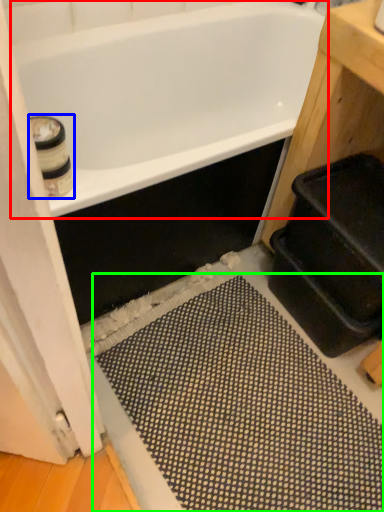
Question: Estimate the real-world distances between objects in this image. Which object is closer to bathtub (highlighted by a red box), toilet paper (highlighted by a blue box) or bath mat (highlighted by a green box)?

Choices:
 (A) toilet paper
 (B) bath mat

Answer: (A)